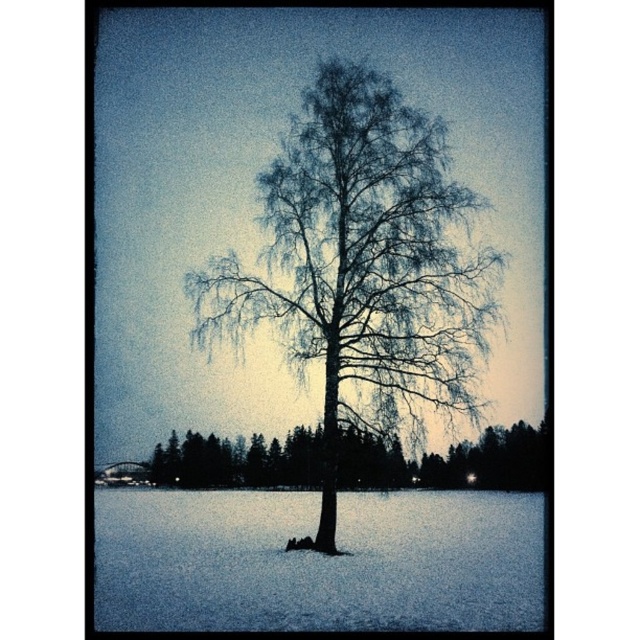
You are planning to place a small garden bench between the bare branches at center and the snowy bark tree at center. Given that the bench requires 30 feet of space to be placed comfortably, will there be enough space?

The distance between the bare branches at center and the snowy bark tree at center is 34.11 feet, which is more than the required 30 feet, so there is enough space to place the bench comfortably.

You are standing at the center of the snowy landscape and notice a point marked at coordinates (362, 266). What does this point indicate?

The point at coordinates (362, 266) indicates bare branches at the center of the snowy landscape.

You are an observer standing in the snowy landscape looking at the scene. Which object is closer to you between the bare branches at center and the snowy bark tree at center?

The bare branches at center is closer to you because it is in front of the snowy bark tree at center.